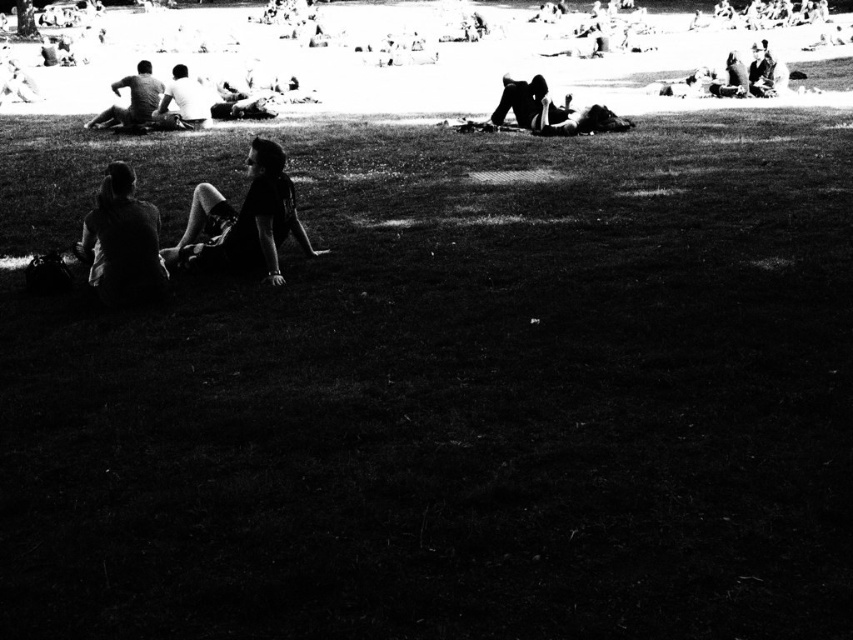
You are a photographer trying to capture a candid shot of the two people sitting on the grass in the park. You need to ensure that both the dark fabric pants at center and the dark fabric jacket at left are in focus. Given that your camera has a depth of field that can cover 30 inches, will you be able to capture both subjects clearly in the same frame?

The distance between the dark fabric pants at center and the dark fabric jacket at left is 30.74 inches. Since your camera can only cover 30 inches in depth of field, you will not be able to capture both subjects clearly in focus in the same frame.

You are a photographer trying to capture a candid shot of two people sitting on the grass. You notice the dark fabric pants at center and the dark fabric jacket at left in your viewfinder. Which object should you focus on if you want to capture the person sitting to the right of the jacket?

The dark fabric pants at center should be focused on because it is positioned on the right side of the dark fabric jacket at left.

You are a photographer standing in the park and want to take a photo of both the dark fabric jacket at left and the dark fabric person at center. Which object should you focus on first to ensure both are in sharp focus?

You should focus on the dark fabric jacket at left first because it is closer to the viewer than the dark fabric person at center. By focusing on the closer object, the farther one may still be in acceptable focus depending on the depth of field.